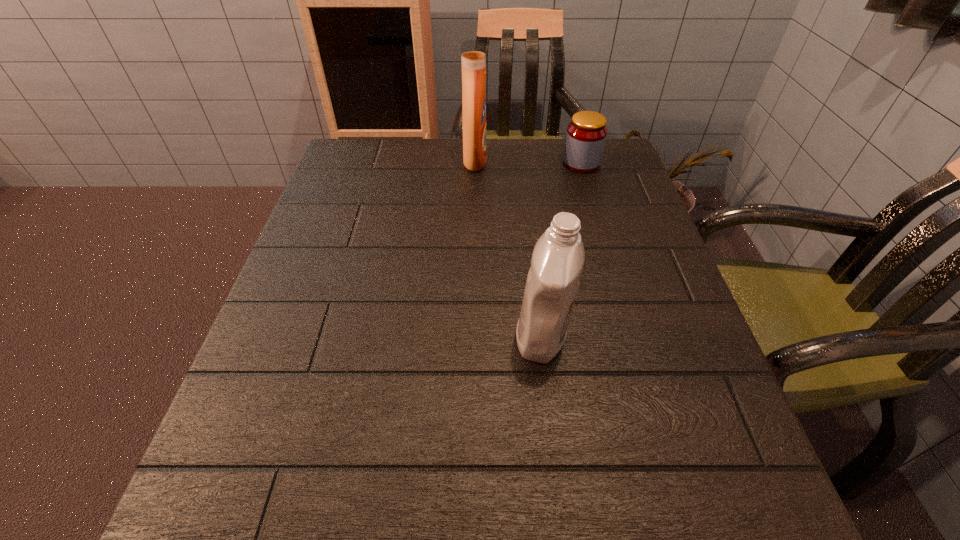
Where is `vacant point that satisfies the following two spatial constraints: 1. on the back side of the shortest object; 2. on the front-facing side of the farther detergent`? The height and width of the screenshot is (540, 960). vacant point that satisfies the following two spatial constraints: 1. on the back side of the shortest object; 2. on the front-facing side of the farther detergent is located at coordinates (581, 161).

This screenshot has width=960, height=540. Find the location of `free spot that satisfies the following two spatial constraints: 1. on the front-facing side of the farther detergent; 2. on the left side of the jar`. free spot that satisfies the following two spatial constraints: 1. on the front-facing side of the farther detergent; 2. on the left side of the jar is located at coordinates (475, 164).